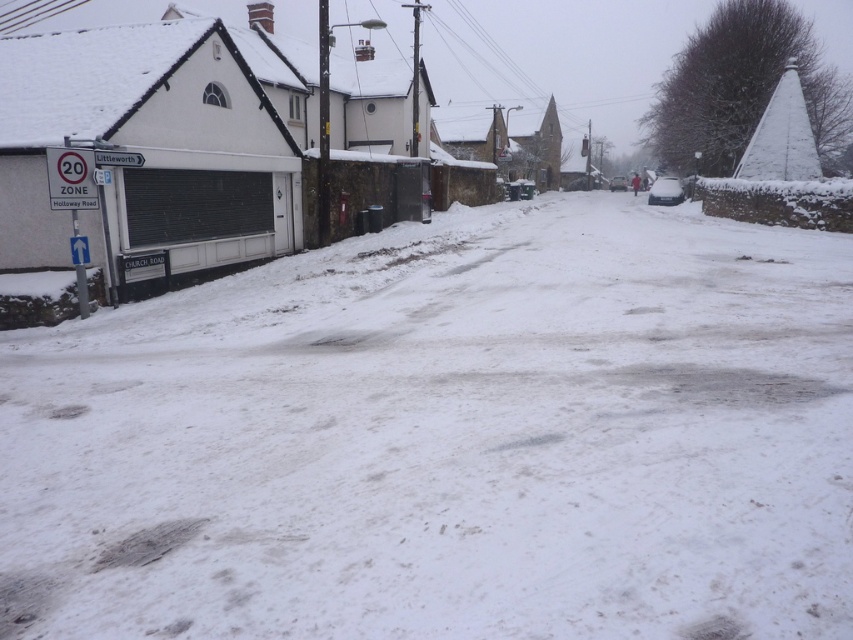
You are driving a car on Church Road and see the white powdery snow at lower left and the gray snow at lower center ahead. Which area has a wider path for your car to drive through?

The white powdery snow at lower left has a wider path since its width surpasses that of the gray snow at lower center.